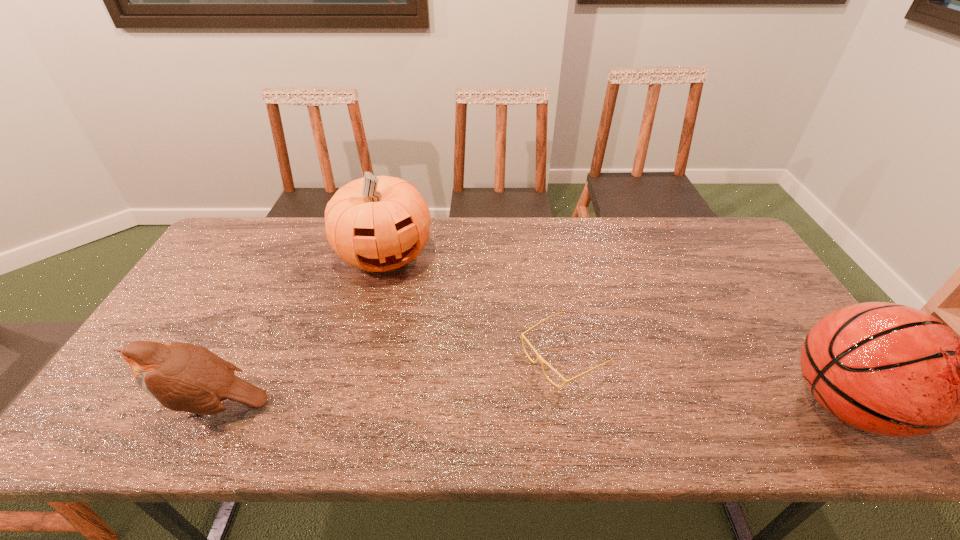
Locate an element on the screen. This screenshot has width=960, height=540. object located at the near left corner is located at coordinates (185, 377).

Locate an element on the screen. The image size is (960, 540). object located at the near right corner is located at coordinates (888, 369).

The image size is (960, 540). I want to click on free space at the far edge of the desktop, so click(x=627, y=222).

You are a GUI agent. You are given a task and a screenshot of the screen. Output one action in this format:
    pyautogui.click(x=<x>, y=<y>)
    Task: Click on the vacant space at the near edge
    Image resolution: width=960 pixels, height=540 pixels.
    Given the screenshot: What is the action you would take?
    pyautogui.click(x=721, y=400)

In the image, there is a desktop. Where is `free space at the left edge`? The image size is (960, 540). free space at the left edge is located at coordinates (172, 311).

Where is `free region at the right edge of the desktop`? free region at the right edge of the desktop is located at coordinates (764, 299).

Where is `vacant space at the far left corner`? This screenshot has width=960, height=540. vacant space at the far left corner is located at coordinates (245, 219).

Find the location of a particular element. Image resolution: width=960 pixels, height=540 pixels. free location at the far right corner of the desktop is located at coordinates (730, 228).

Identify the location of vacant point located between the pumpkin and the rightmost object. The height and width of the screenshot is (540, 960). (614, 329).

Identify the location of free space between the farthest object and the basketball. This screenshot has height=540, width=960. (614, 329).